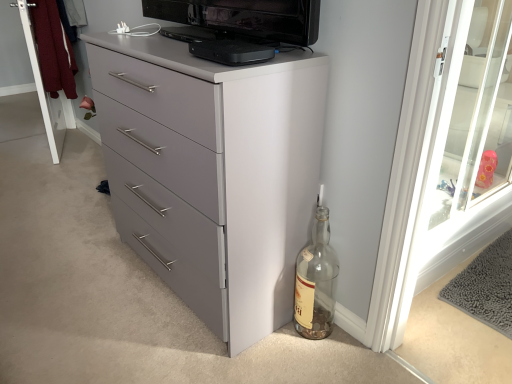
Where is `free region on the left part of white wood screen door at upper left, positioned as the second screen door in front-to-back order`? The height and width of the screenshot is (384, 512). free region on the left part of white wood screen door at upper left, positioned as the second screen door in front-to-back order is located at coordinates 27,145.